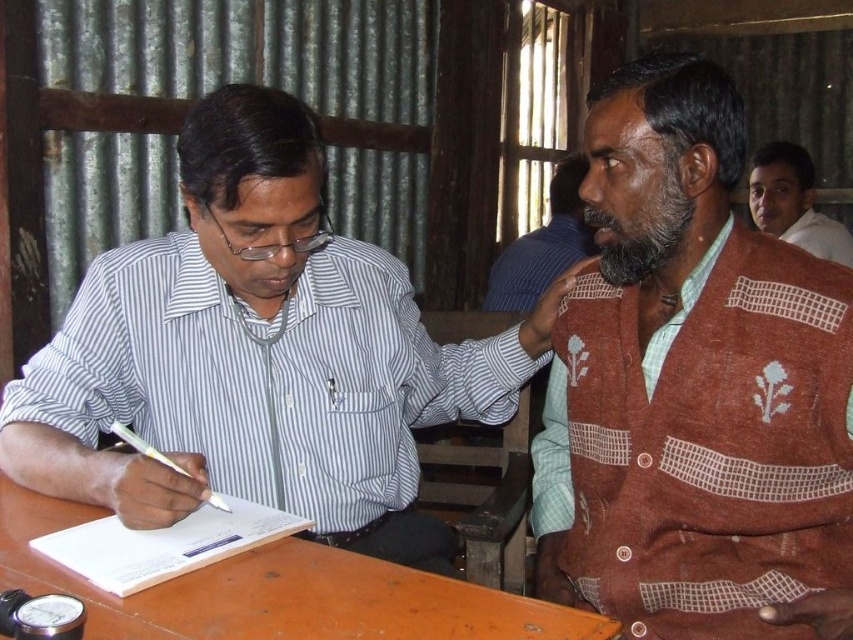
Between striped cotton shirt at left and white paper at lower left, which one is positioned higher?

striped cotton shirt at left is above.

Identify the location of striped cotton shirt at left. (259, 355).

Who is more forward, [62,326] or [490,298]?

Point [62,326] is in front.

Between striped cotton shirt at left and brown knitted sweater at upper right, which one is positioned higher?

brown knitted sweater at upper right

Does point (120, 328) come farther from viewer compared to point (508, 269)?

No, (120, 328) is in front of (508, 269).

Where is `striped cotton shirt at left`? Image resolution: width=853 pixels, height=640 pixels. striped cotton shirt at left is located at coordinates (259, 355).

Between point (718, 609) and point (503, 296), which one is positioned in front?

Positioned in front is point (718, 609).

Describe the element at coordinates (694, 387) in the screenshot. The height and width of the screenshot is (640, 853). I see `brown knitted sweater at right` at that location.

Image resolution: width=853 pixels, height=640 pixels. In order to click on brown knitted sweater at right in this screenshot , I will do `click(694, 387)`.